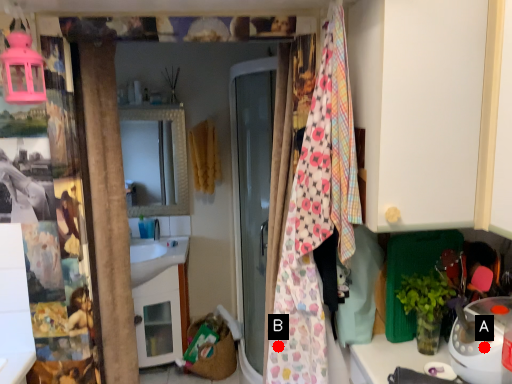
Question: Two points are circled on the image, labeled by A and B beside each circle. Which of the following is the farthest from the observer?

Choices:
 (A) A is further
 (B) B is further

Answer: (B)